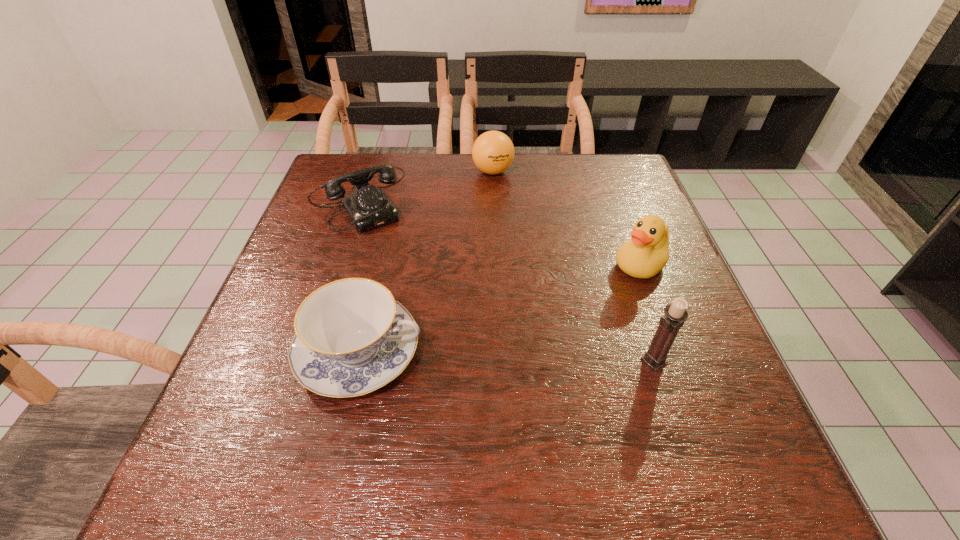
Image resolution: width=960 pixels, height=540 pixels. I want to click on chinaware located at the left edge, so click(x=351, y=338).

Find the location of a particular element. telephone that is at the left edge is located at coordinates (368, 207).

Identify the location of candle holder that is at the right edge. This screenshot has width=960, height=540. (675, 315).

Identify the location of duck at the right edge. The width and height of the screenshot is (960, 540). (646, 254).

The width and height of the screenshot is (960, 540). Find the location of `object that is at the far left corner`. object that is at the far left corner is located at coordinates (368, 207).

At what (x,y) coordinates should I click in order to perform the action: click on object that is at the near left corner. Please return your answer as a coordinate pair (x, y). The height and width of the screenshot is (540, 960). Looking at the image, I should click on (351, 338).

In the image, there is a desktop. Find the location of `free space at the far edge`. free space at the far edge is located at coordinates (444, 185).

At what (x,y) coordinates should I click in order to perform the action: click on vacant space at the near edge. Please return your answer as a coordinate pair (x, y). This screenshot has width=960, height=540. Looking at the image, I should click on (423, 434).

Identify the location of free region at the left edge of the desktop. The image size is (960, 540). (320, 202).

In the image, there is a desktop. Identify the location of vacant space at the right edge. (621, 222).